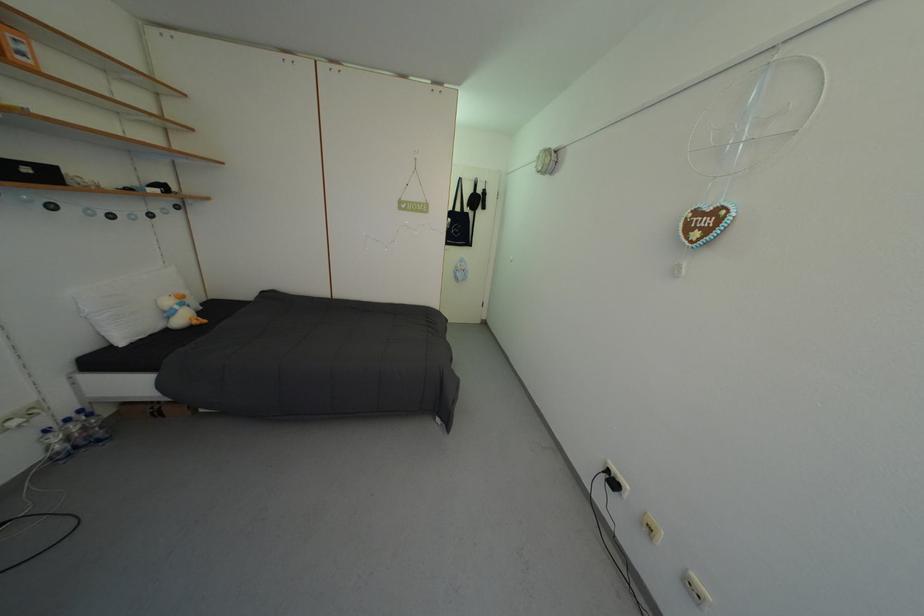
Locate an element on the screen. The height and width of the screenshot is (616, 924). orange picture frame is located at coordinates (17, 47).